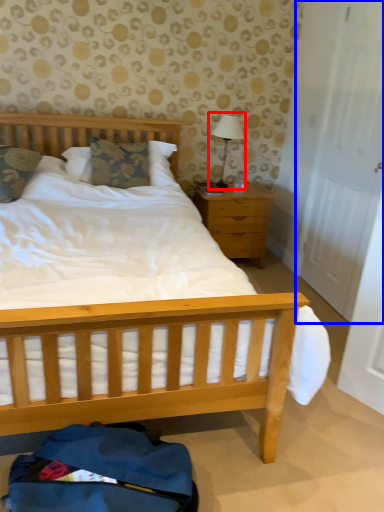
Question: Which object is further to the camera taking this photo, table lamp (highlighted by a red box) or door (highlighted by a blue box)?

Choices:
 (A) table lamp
 (B) door

Answer: (A)